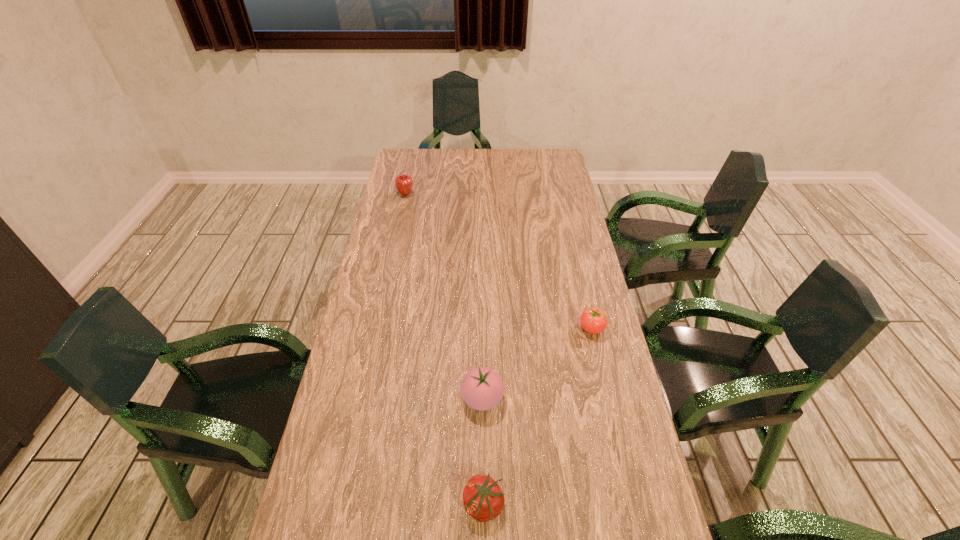
Locate an element on the screen. This screenshot has height=540, width=960. free space between the tallest tomato and the nearest tomato is located at coordinates (483, 452).

Identify the location of free spot between the farthest tomato and the farthest object. The image size is (960, 540). (498, 261).

Where is `unoccupied position between the rightmost tomato and the second nearest object`? This screenshot has height=540, width=960. unoccupied position between the rightmost tomato and the second nearest object is located at coordinates (537, 363).

Where is `empty space between the leftmost object and the second farthest tomato`? Image resolution: width=960 pixels, height=540 pixels. empty space between the leftmost object and the second farthest tomato is located at coordinates (444, 296).

Identify the location of empty space between the farthest object and the tallest tomato. (444, 296).

Image resolution: width=960 pixels, height=540 pixels. Identify the location of vacant area between the rightmost object and the second farthest tomato. (537, 363).

Where is `empty space between the second nearest tomato and the farthest object`? The height and width of the screenshot is (540, 960). empty space between the second nearest tomato and the farthest object is located at coordinates (444, 296).

Locate which object is the third closest to the tallest tomato. Please provide its 2D coordinates. Your answer should be formatted as a tuple, i.e. [(x, y)], where the tuple contains the x and y coordinates of a point satisfying the conditions above.

[(404, 182)]

Identify which object is located as the third nearest to the apple. Please provide its 2D coordinates. Your answer should be formatted as a tuple, i.e. [(x, y)], where the tuple contains the x and y coordinates of a point satisfying the conditions above.

[(483, 499)]

Select which tomato is the second closest to the nearest tomato. Please provide its 2D coordinates. Your answer should be formatted as a tuple, i.e. [(x, y)], where the tuple contains the x and y coordinates of a point satisfying the conditions above.

[(593, 320)]